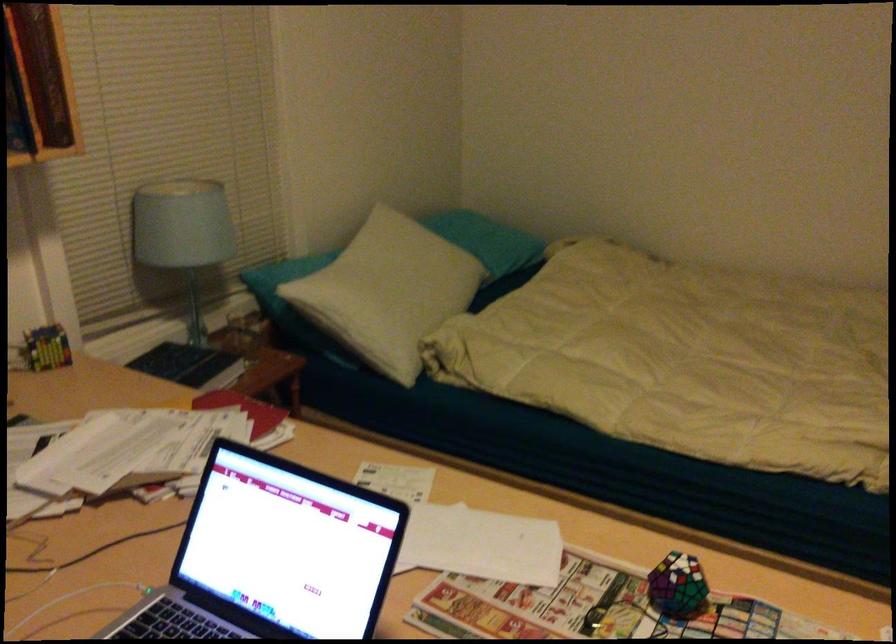
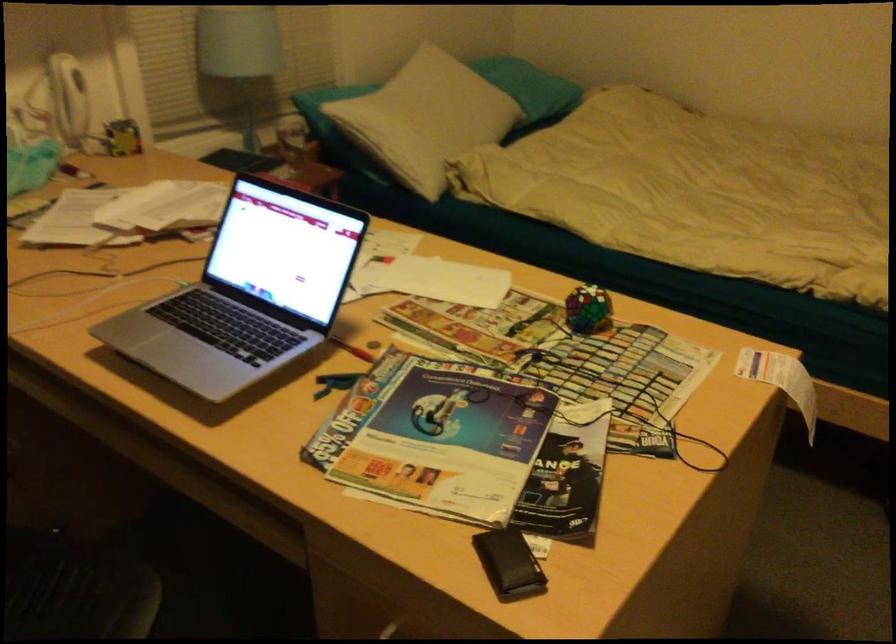
Looking at this image, in a continuous first-person perspective shot, in which direction is the camera moving?

The movement direction of the cameraman is right, backward.